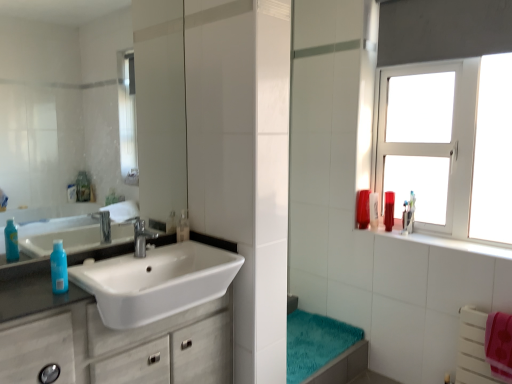
Find the location of `vacant area that is in front of translucent plastic mouthwash at sink, the 4th mouthwash viewed from the back`. vacant area that is in front of translucent plastic mouthwash at sink, the 4th mouthwash viewed from the back is located at coordinates (173, 244).